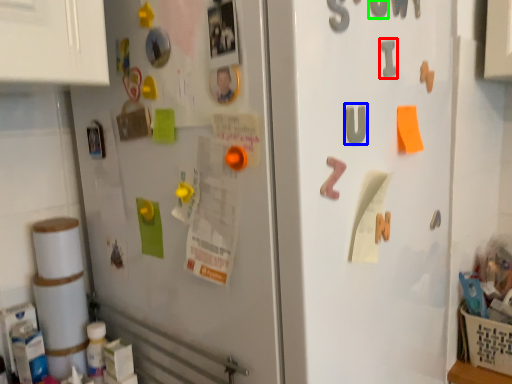
Question: Which is farther away from alphabet (highlighted by a red box)? alphabet (highlighted by a blue box) or number (highlighted by a green box)?

Choices:
 (A) alphabet
 (B) number

Answer: (A)